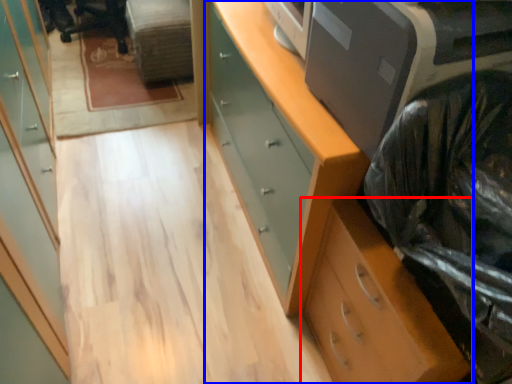
Question: Which of the following is the farthest to the observer, chest of drawers (highlighted by a red box) or chest of drawers (highlighted by a blue box)?

Choices:
 (A) chest of drawers
 (B) chest of drawers

Answer: (B)